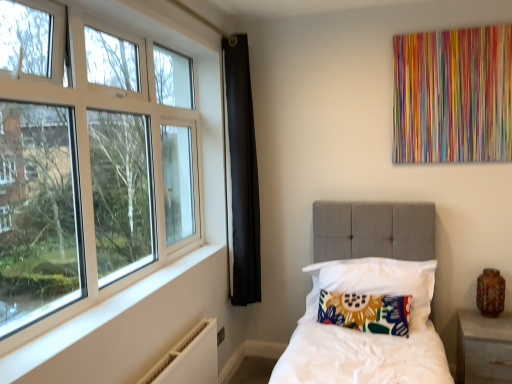
What do you see at coordinates (104, 166) in the screenshot? The image size is (512, 384). I see `white plastic window at left` at bounding box center [104, 166].

The height and width of the screenshot is (384, 512). What do you see at coordinates (189, 358) in the screenshot? I see `white textured radiator at lower left` at bounding box center [189, 358].

Image resolution: width=512 pixels, height=384 pixels. I want to click on floral fabric pillow at center, the second pillow viewed from the top, so click(366, 312).

Which of these two, floral fabric pillow at center, the second pillow viewed from the top, or matte gray nightstand at lower right, is bigger?

With larger size is matte gray nightstand at lower right.

Does floral fabric pillow at center, the second pillow viewed from the top, have a lesser height compared to matte gray nightstand at lower right?

Correct, floral fabric pillow at center, the second pillow viewed from the top, is not as tall as matte gray nightstand at lower right.

Is point (380, 324) in front of point (460, 369)?

Yes, it is in front of point (460, 369).

Is floral fabric pillow at center, the second pillow viewed from the top, directly adjacent to matte gray nightstand at lower right?

floral fabric pillow at center, the second pillow viewed from the top, and matte gray nightstand at lower right are clearly separated.

In the scene shown: Can you confirm if floral fabric pillow at center, the 1th pillow viewed from the top, is positioned to the left of white textured radiator at lower left?

No.

Considering the positions of objects floral fabric pillow at center, the 1th pillow viewed from the top, and white textured radiator at lower left in the image provided, who is behind, floral fabric pillow at center, the 1th pillow viewed from the top, or white textured radiator at lower left?

floral fabric pillow at center, the 1th pillow viewed from the top.

Does point (332, 276) come behind point (211, 345)?

Yes, it is.

Consider the image. Is floral fabric pillow at center, the 1th pillow viewed from the top, not close to white textured radiator at lower left?

No.

Considering the sizes of matte gray nightstand at lower right and white plastic window at left in the image, is matte gray nightstand at lower right bigger or smaller than white plastic window at left?

Considering their sizes, matte gray nightstand at lower right takes up less space than white plastic window at left.

Locate an element on the screen. The image size is (512, 384). window that is above the matte gray nightstand at lower right (from the image's perspective) is located at coordinates (104, 166).

How many degrees apart are the facing directions of matte gray nightstand at lower right and white plastic window at left?

matte gray nightstand at lower right and white plastic window at left are facing 92.3 degrees away from each other.

Can you confirm if matte gray nightstand at lower right is taller than white plastic window at left?

No, matte gray nightstand at lower right is not taller than white plastic window at left.

Which is more to the left, matte gray nightstand at lower right or floral fabric pillow at center, the 1th pillow viewed from the top?

Positioned to the left is floral fabric pillow at center, the 1th pillow viewed from the top.

Who is bigger, matte gray nightstand at lower right or floral fabric pillow at center, marked as the 2th pillow in a bottom-to-top arrangement?

Bigger between the two is floral fabric pillow at center, marked as the 2th pillow in a bottom-to-top arrangement.

From a real-world perspective, which object rests below the other?

matte gray nightstand at lower right, from a real-world perspective.

Is matte gray nightstand at lower right positioned far away from floral fabric pillow at center, marked as the 2th pillow in a bottom-to-top arrangement?

No, matte gray nightstand at lower right is not far away from floral fabric pillow at center, marked as the 2th pillow in a bottom-to-top arrangement.

Is matte gray nightstand at lower right positioned behind floral fabric pillow at center, which appears as the 1th pillow when ordered from the bottom?

No, it is in front of floral fabric pillow at center, which appears as the 1th pillow when ordered from the bottom.

Considering the sizes of matte gray nightstand at lower right and floral fabric pillow at center, the second pillow viewed from the top, in the image, is matte gray nightstand at lower right taller or shorter than floral fabric pillow at center, the second pillow viewed from the top,?

In the image, matte gray nightstand at lower right appears to be taller than floral fabric pillow at center, the second pillow viewed from the top.

In the scene shown: Is matte gray nightstand at lower right smaller than floral fabric pillow at center, which appears as the 1th pillow when ordered from the bottom?

No.

Is matte gray nightstand at lower right wider than floral fabric pillow at center, the second pillow viewed from the top?

Yes, matte gray nightstand at lower right is wider than floral fabric pillow at center, the second pillow viewed from the top.

Between matte gray nightstand at lower right and white textured radiator at lower left, which one is positioned behind?

matte gray nightstand at lower right is more distant.

From the image's perspective, which one is positioned higher, matte gray nightstand at lower right or white textured radiator at lower left?

white textured radiator at lower left is shown above in the image.

From a real-world perspective, which object rests below the other?

matte gray nightstand at lower right.

Does matte gray nightstand at lower right have a greater width compared to white textured radiator at lower left?

Yes.

Is there a large distance between floral fabric pillow at center, the second pillow viewed from the top, and white plastic window at left?

Yes, floral fabric pillow at center, the second pillow viewed from the top, and white plastic window at left are quite far apart.

You are a GUI agent. You are given a task and a screenshot of the screen. Output one action in this format:
    pyautogui.click(x=<x>, y=<y>)
    Task: Click on the window that is on the left side of floral fabric pillow at center, which appears as the 1th pillow when ordered from the bottom
    The height and width of the screenshot is (384, 512).
    Given the screenshot: What is the action you would take?
    pyautogui.click(x=104, y=166)

Does floral fabric pillow at center, which appears as the 1th pillow when ordered from the bottom, have a larger size compared to white plastic window at left?

Actually, floral fabric pillow at center, which appears as the 1th pillow when ordered from the bottom, might be smaller than white plastic window at left.

Considering the relative sizes of floral fabric pillow at center, which appears as the 1th pillow when ordered from the bottom, and white plastic window at left in the image provided, is floral fabric pillow at center, which appears as the 1th pillow when ordered from the bottom, shorter than white plastic window at left?

Yes.

Locate an element on the screen. the 1st pillow behind the matte gray nightstand at lower right is located at coordinates (366, 312).

Locate an element on the screen. radiator on the left of the floral fabric pillow at center, the 1th pillow viewed from the top is located at coordinates pos(189,358).

When comparing their distances from floral fabric pillow at center, which appears as the 1th pillow when ordered from the bottom, does matte gray nightstand at lower right or white plastic window at left seem closer?

matte gray nightstand at lower right is positioned closer to the anchor floral fabric pillow at center, which appears as the 1th pillow when ordered from the bottom.

Looking at the image, which one is located closer to floral fabric pillow at center, the 1th pillow viewed from the top, floral fabric pillow at center, the second pillow viewed from the top, or white textured radiator at lower left?

floral fabric pillow at center, the second pillow viewed from the top, is closer to floral fabric pillow at center, the 1th pillow viewed from the top.

When comparing their distances from floral fabric pillow at center, the 1th pillow viewed from the top, does floral fabric pillow at center, which appears as the 1th pillow when ordered from the bottom, or matte gray nightstand at lower right seem further?

matte gray nightstand at lower right lies further to floral fabric pillow at center, the 1th pillow viewed from the top, than the other object.

From the picture: From the image, which object appears to be nearer to white textured radiator at lower left, floral fabric pillow at center, the second pillow viewed from the top, or matte gray nightstand at lower right?

Among the two, floral fabric pillow at center, the second pillow viewed from the top, is located nearer to white textured radiator at lower left.

Based on their spatial positions, is floral fabric pillow at center, which appears as the 1th pillow when ordered from the bottom, or white plastic window at left closer to white textured radiator at lower left?

Based on the image, floral fabric pillow at center, which appears as the 1th pillow when ordered from the bottom, appears to be nearer to white textured radiator at lower left.

Based on the photo, estimate the real-world distances between objects in this image. Which object is closer to floral fabric pillow at center, marked as the 2th pillow in a bottom-to-top arrangement, white textured radiator at lower left or matte gray nightstand at lower right?

The object closer to floral fabric pillow at center, marked as the 2th pillow in a bottom-to-top arrangement, is matte gray nightstand at lower right.

When comparing their distances from matte gray nightstand at lower right, does floral fabric pillow at center, marked as the 2th pillow in a bottom-to-top arrangement, or white textured radiator at lower left seem further?

white textured radiator at lower left lies further to matte gray nightstand at lower right than the other object.

From the image, which object appears to be farther from white textured radiator at lower left, white plastic window at left or floral fabric pillow at center, the 1th pillow viewed from the top?

white plastic window at left is further to white textured radiator at lower left.

The width and height of the screenshot is (512, 384). I want to click on pillow located between floral fabric pillow at center, the second pillow viewed from the top, and matte gray nightstand at lower right in the left-right direction, so click(375, 282).

The height and width of the screenshot is (384, 512). I want to click on pillow between white textured radiator at lower left and floral fabric pillow at center, marked as the 2th pillow in a bottom-to-top arrangement, in the horizontal direction, so click(366, 312).

This screenshot has height=384, width=512. What are the coordinates of `radiator between white plastic window at left and floral fabric pillow at center, the 1th pillow viewed from the top, in the horizontal direction` in the screenshot? It's located at (189, 358).

Identify the location of radiator between white plastic window at left and floral fabric pillow at center, which appears as the 1th pillow when ordered from the bottom, in the horizontal direction. This screenshot has width=512, height=384. (189, 358).